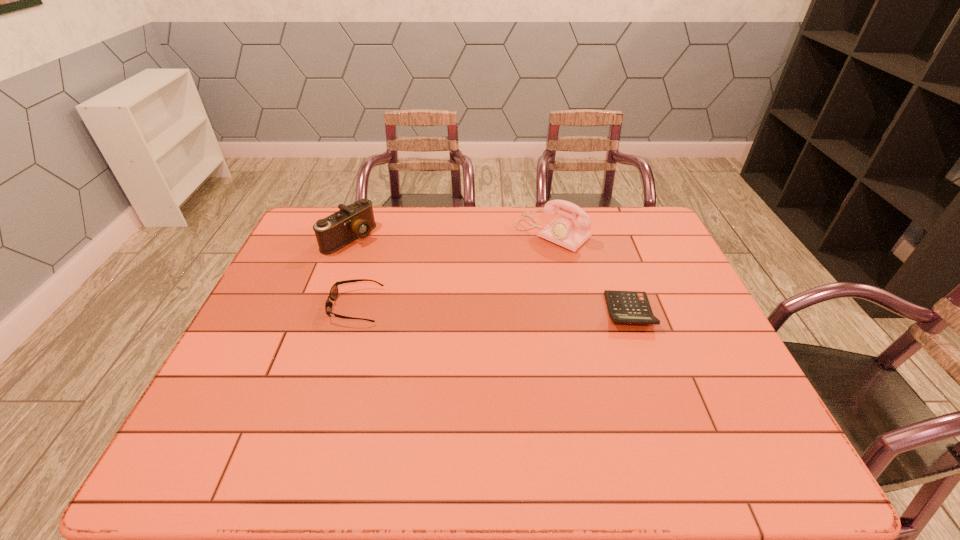
Locate an element on the screen. This screenshot has height=540, width=960. unoccupied area between the tallest object and the third shortest object is located at coordinates (451, 235).

Image resolution: width=960 pixels, height=540 pixels. In order to click on free space between the sunglasses and the camera in this screenshot , I will do `click(352, 272)`.

This screenshot has height=540, width=960. I want to click on free point between the camera and the tallest object, so click(451, 235).

Where is `free point between the calculator and the camera`? The height and width of the screenshot is (540, 960). free point between the calculator and the camera is located at coordinates (490, 274).

Locate an element on the screen. The image size is (960, 540). free space between the calculator and the camera is located at coordinates (490, 274).

The width and height of the screenshot is (960, 540). Identify the location of free point between the telephone and the camera. (451, 235).

This screenshot has width=960, height=540. In order to click on the closest object to the sunglasses in this screenshot , I will do `click(356, 220)`.

What are the coordinates of `object that ranks as the closest to the sunglasses` in the screenshot? It's located at (356, 220).

Image resolution: width=960 pixels, height=540 pixels. I want to click on vacant point that satisfies the following two spatial constraints: 1. on the front side of the sunglasses; 2. on the front-facing side of the camera, so click(324, 306).

The width and height of the screenshot is (960, 540). Find the location of `vacant region that satisfies the following two spatial constraints: 1. on the front side of the sunglasses; 2. on the front-facing side of the camera`. vacant region that satisfies the following two spatial constraints: 1. on the front side of the sunglasses; 2. on the front-facing side of the camera is located at coordinates (324, 306).